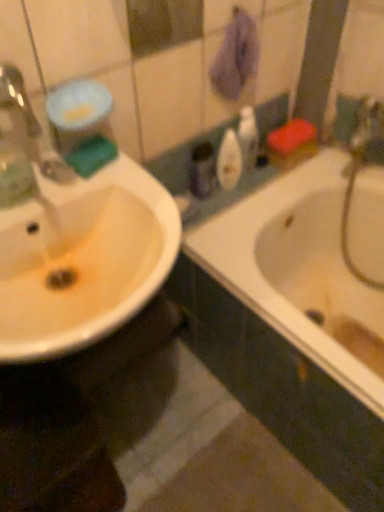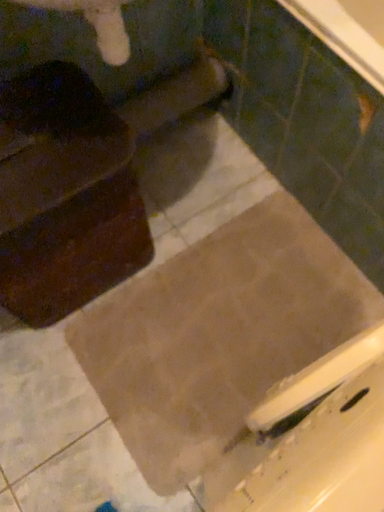
Question: How did the camera likely rotate when shooting the video?

Choices:
 (A) rotated upward
 (B) rotated downward

Answer: (B)